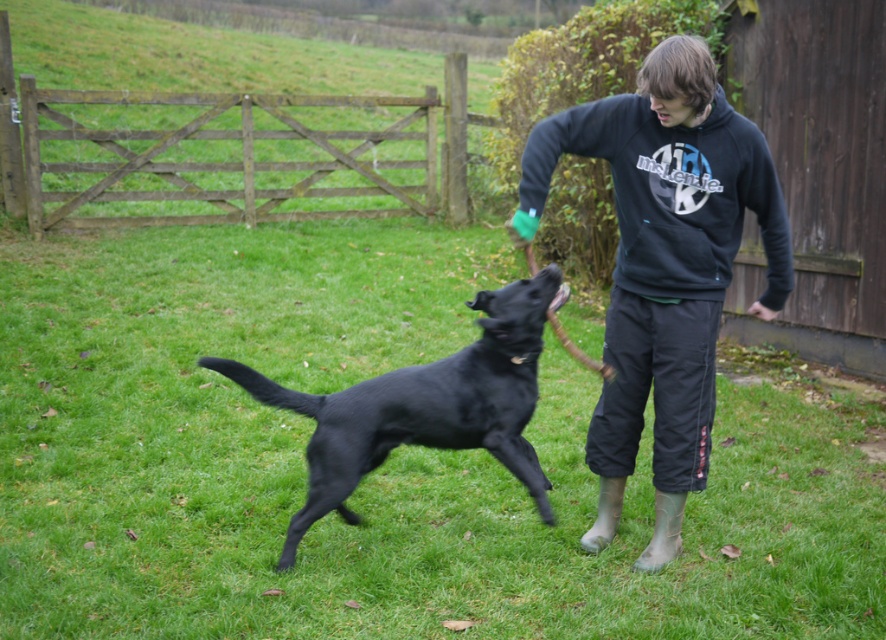
You are standing at the edge of the grassy yard and want to toss a ball to the dark blue hoodie at center without it rolling into the green grass at center. Can you do this if the ball rolls 1.5 meters?

The distance between the green grass at center and the dark blue hoodie at center is 2.00 meters. Since the ball only rolls 1.5 meters, it won not reach the green grass at center, so yes, you can toss the ball to the dark blue hoodie at center without it rolling into the green grass at center.